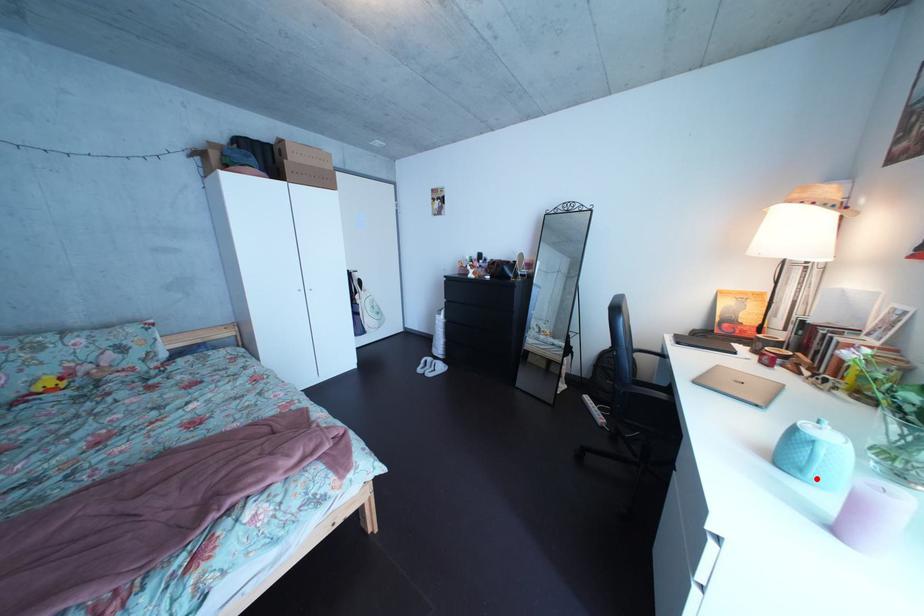
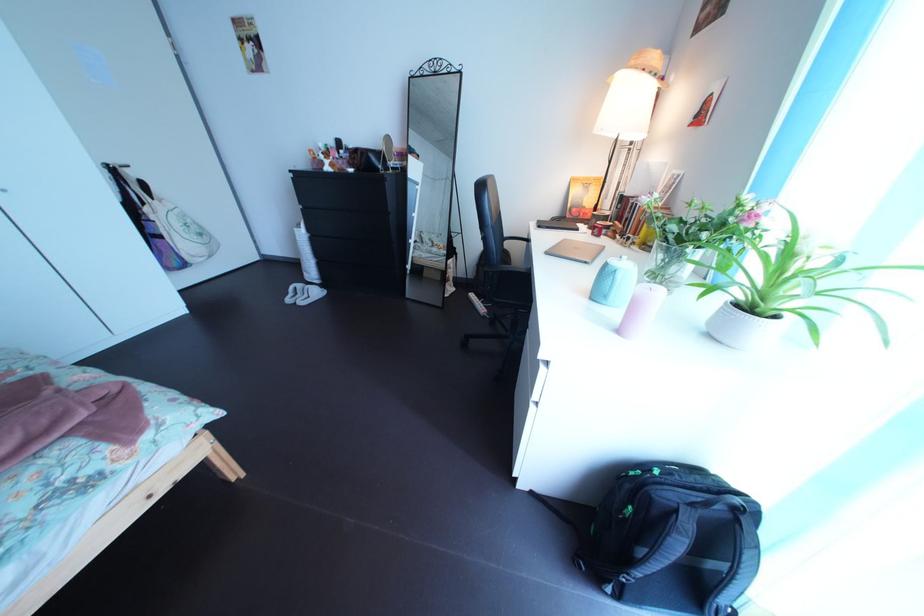
The point at the highlighted location is marked in the first image. Where is the corresponding point in the second image?

(621, 305)